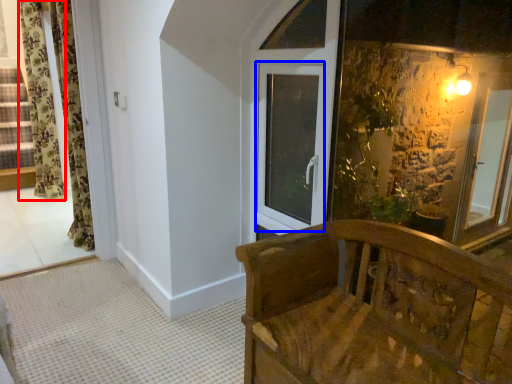
Question: Which object appears farthest to the camera in this image, curtain (highlighted by a red box) or window (highlighted by a blue box)?

Choices:
 (A) curtain
 (B) window

Answer: (A)